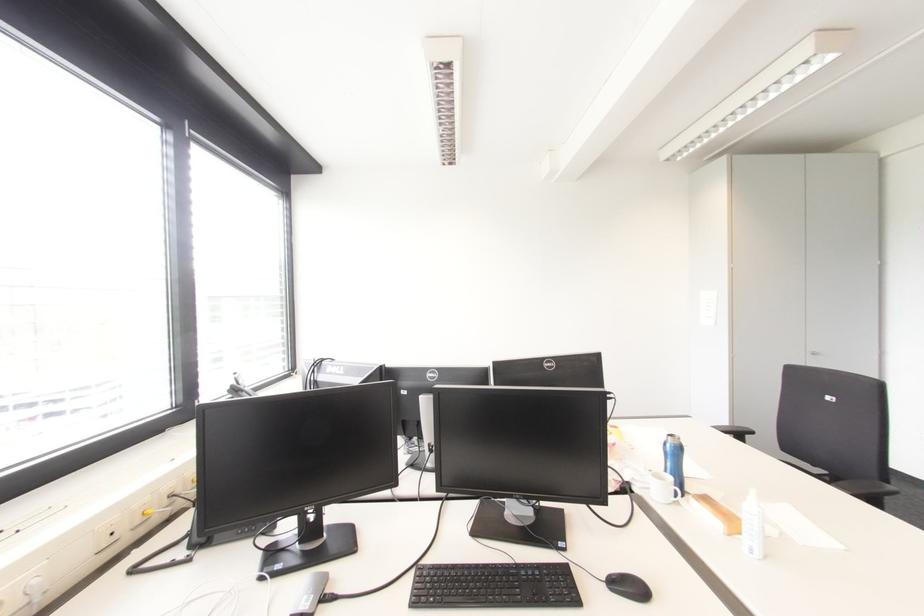
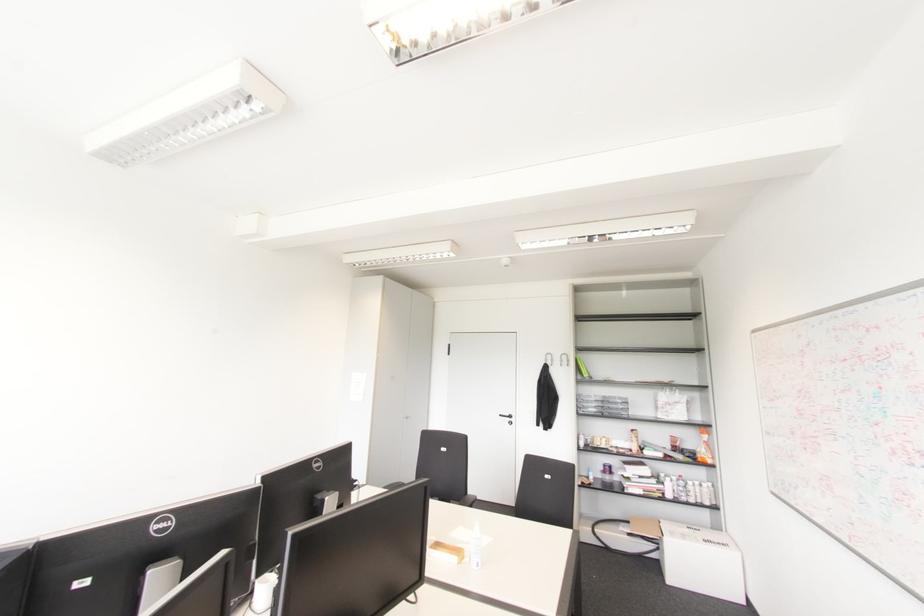
Question: The camera is either moving clockwise (left) or counter-clockwise (right) around the object. The first image is from the beginning of the video and the second image is from the end. Is the camera moving left or right when shooting the video?

Choices:
 (A) Left
 (B) Right

Answer: (A)